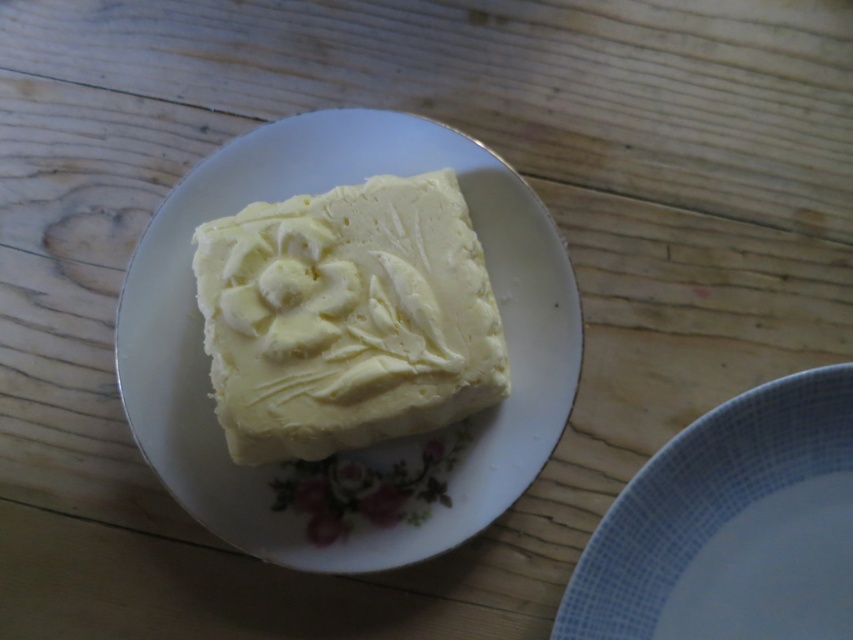
You are arranging dishes on a table and need to place a new plate between the white porcelain plate at center and the white ceramic plate at lower right. Which direction should you place it to maintain the existing arrangement?

The white porcelain plate at center is above the white ceramic plate at lower right, so to maintain the existing arrangement, you should place the new plate below the white porcelain plate at center and above the white ceramic plate at lower right.

You are taking a photo of the butter on the plate. You want to focus on the point closer to the camera between the two points labeled as point (123,392) and point (604,547). Which point should you focus on?

You should focus on point (123,392) because it is further to the camera than point (604,547).

You are standing in front of the wooden table with the white plate and the blue and white checkered plate. You want to place a small decoration between the two points labeled as point (254, 310) and point (695, 476). Which point should the decoration be closer to if it needs to be placed behind the blue and white checkered plate?

The decoration should be placed closer to point (254, 310) because it is behind point (695, 476), which is near the blue and white checkered plate.